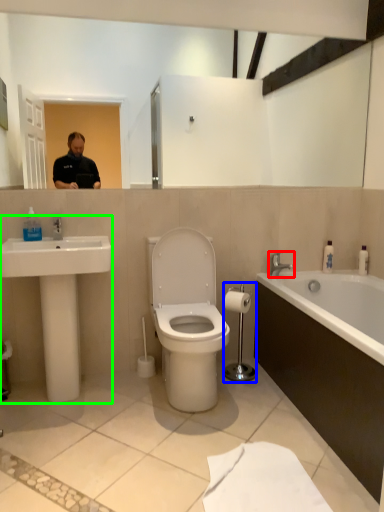
Question: Based on their relative distances, which object is nearer to tap (highlighted by a red box)? Choose from towel bar (highlighted by a blue box) and sink (highlighted by a green box).

Choices:
 (A) towel bar
 (B) sink

Answer: (A)